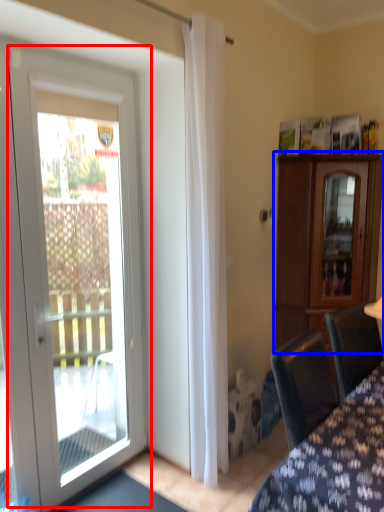
Question: Among these objects, which one is farthest to the camera, door (highlighted by a red box) or cabinetry (highlighted by a blue box)?

Choices:
 (A) door
 (B) cabinetry

Answer: (B)